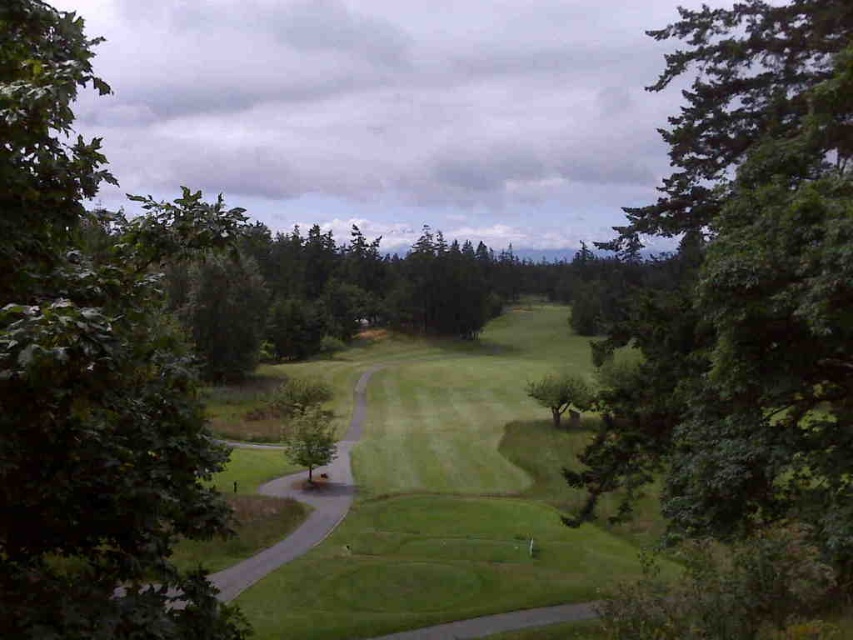
You are a golfer standing on the green grassy path at center and want to reach the green grassy field at center. Which direction should you move to get there?

The green grassy field at center is positioned on the right side of the green grassy path at center, so you should move to the right to reach it.